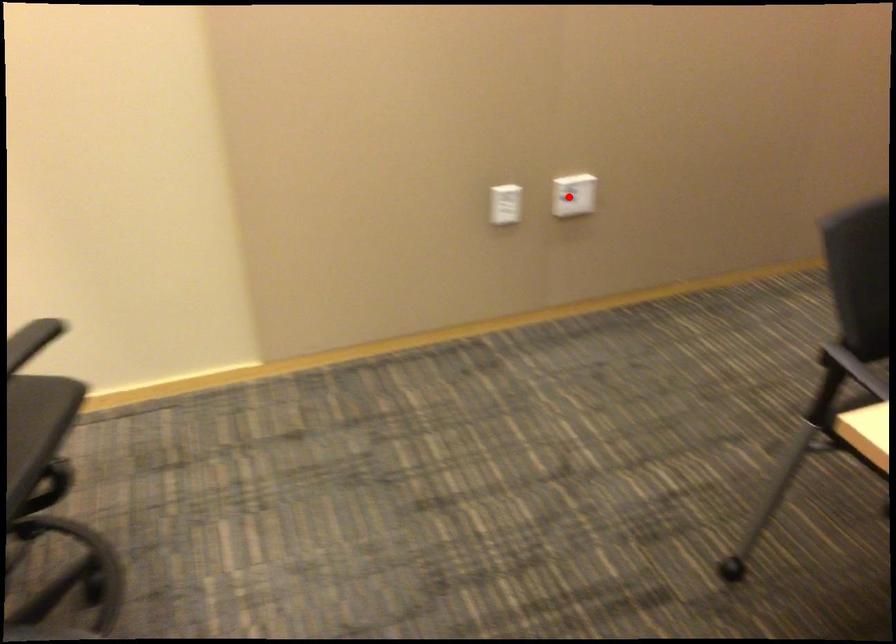
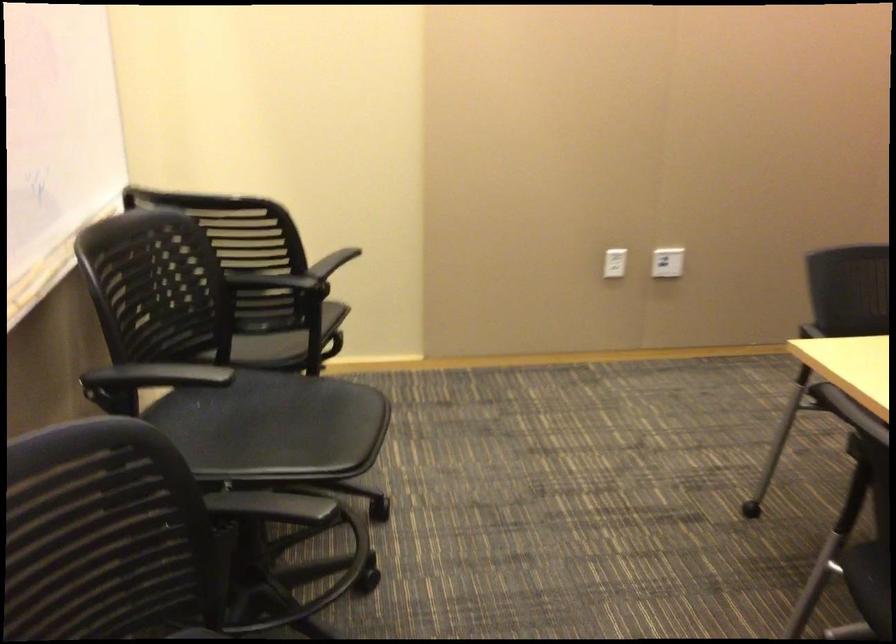
Question: I am providing you with two images of the same scene from different viewpoints. In image1, a red point is highlighted. Considering the same 3D point in image2, which of the following is correct?

Choices:
 (A) It is closer
 (B) It is farther

Answer: (B)